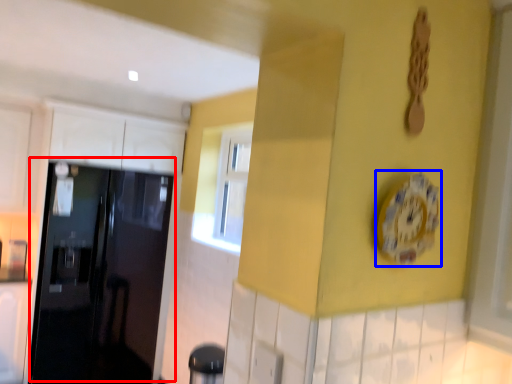
Question: Which object is closer to the camera taking this photo, door (highlighted by a red box) or clock (highlighted by a blue box)?

Choices:
 (A) door
 (B) clock

Answer: (B)